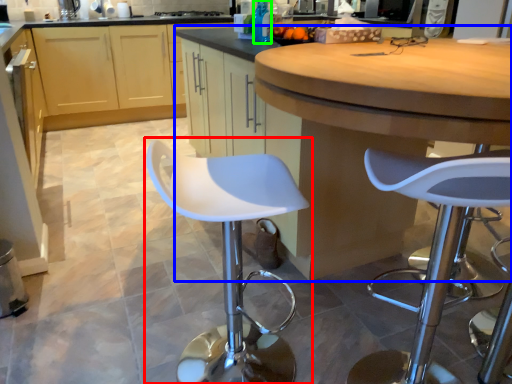
Question: Estimate the real-world distances between objects in this image. Which object is closer to chair (highlighted by a red box), cabinetry (highlighted by a blue box) or bottle (highlighted by a green box)?

Choices:
 (A) cabinetry
 (B) bottle

Answer: (A)